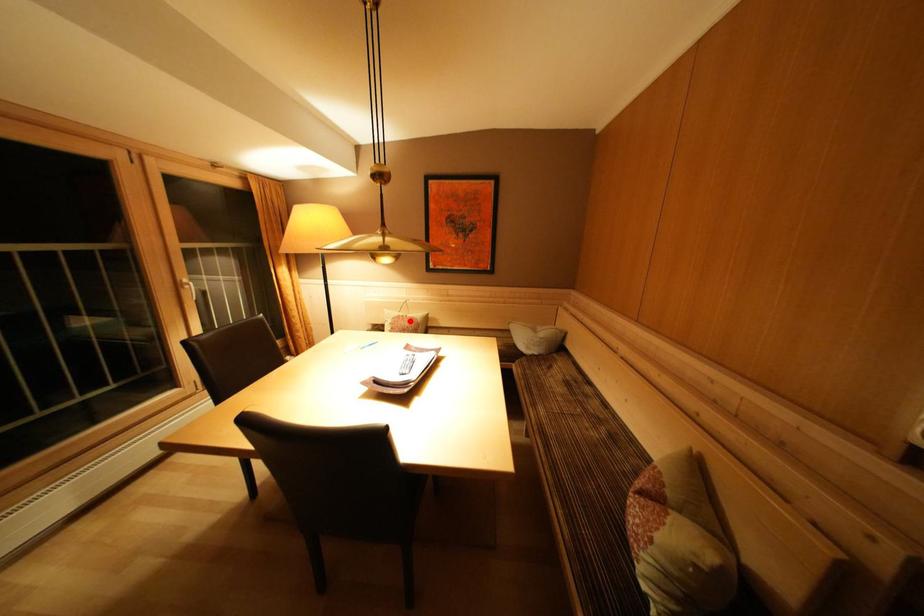
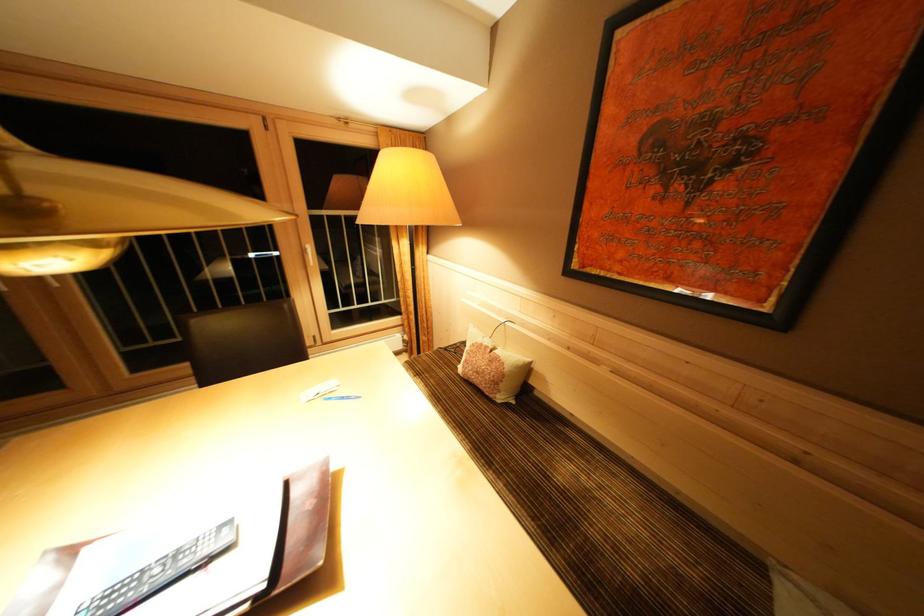
In the second image, find the point that corresponds to the highlighted location in the first image.

(493, 352)